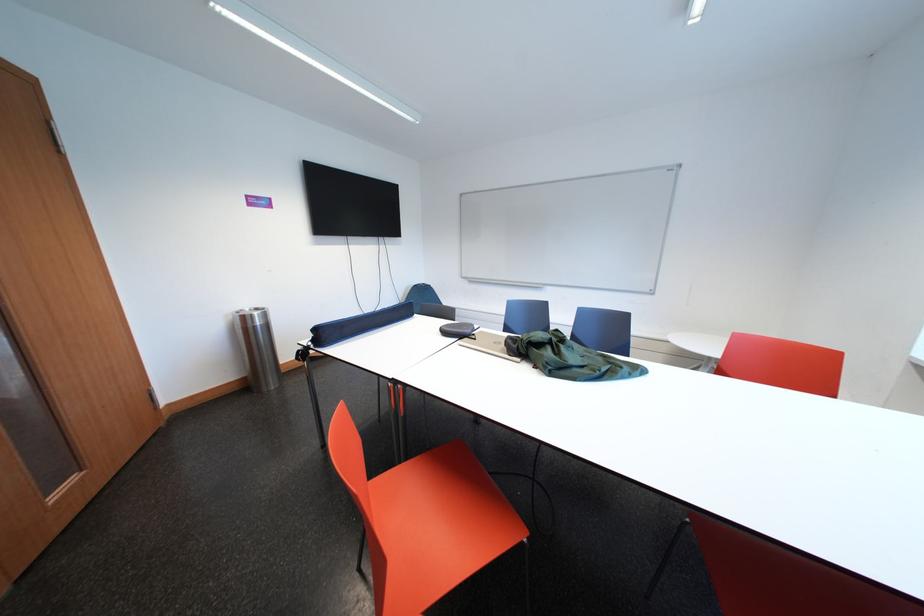
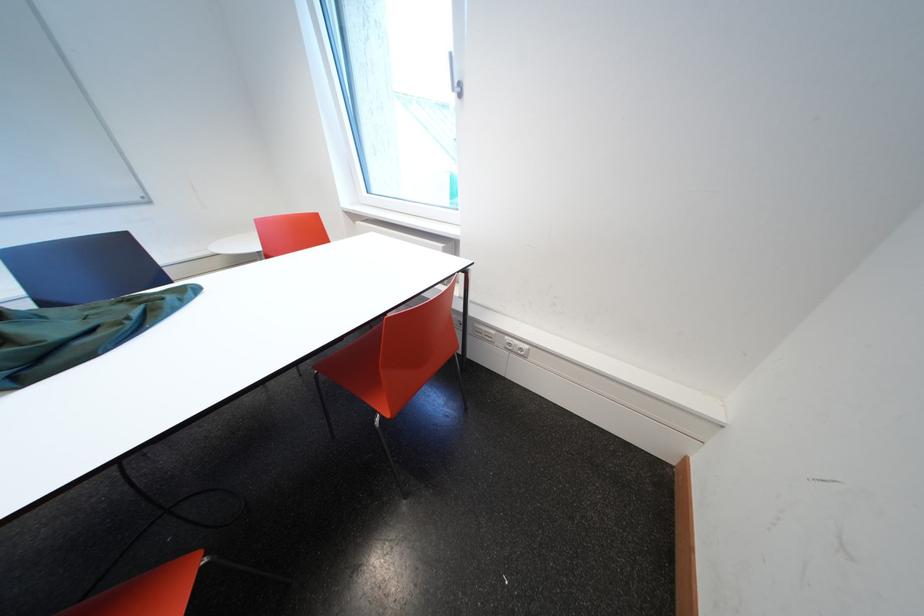
First-person continuous shooting, in which direction is the camera rotating?

The rotation direction of the camera is right-down.